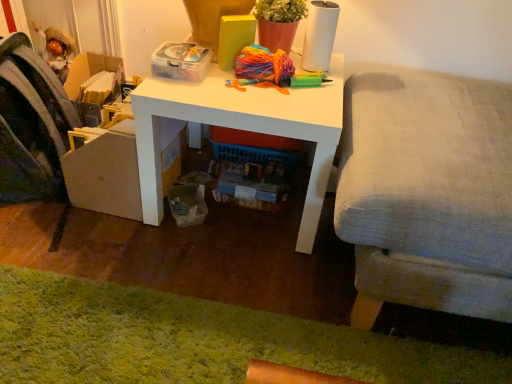
Find the location of `vacant region above green shaggy rug at lower left (from a real-world perspective)`. vacant region above green shaggy rug at lower left (from a real-world perspective) is located at coordinates (188, 336).